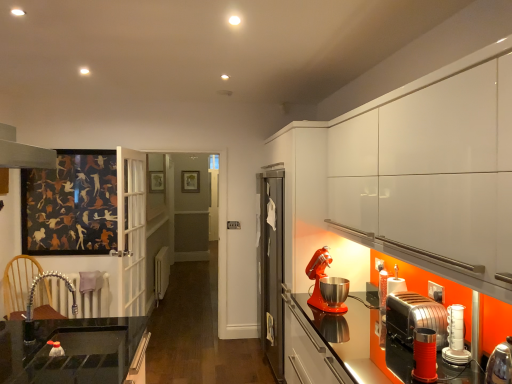
Question: Can you confirm if metallic red toaster at lower right, positioned as the 1th kitchen appliance in front-to-back order, is wider than wooden picture frame at center?

Choices:
 (A) yes
 (B) no

Answer: (A)

Question: Is metallic red toaster at lower right, which appears as the 4th kitchen appliance when viewed from the back, taller than wooden picture frame at center?

Choices:
 (A) yes
 (B) no

Answer: (B)

Question: Is metallic red toaster at lower right, positioned as the 1th kitchen appliance in front-to-back order, placed right next to wooden picture frame at center?

Choices:
 (A) yes
 (B) no

Answer: (B)

Question: From the image's perspective, would you say metallic red toaster at lower right, which appears as the 4th kitchen appliance when viewed from the back, is positioned over wooden picture frame at center?

Choices:
 (A) yes
 (B) no

Answer: (B)

Question: Considering the relative positions of metallic red toaster at lower right, which appears as the 4th kitchen appliance when viewed from the back, and wooden picture frame at center in the image provided, is metallic red toaster at lower right, which appears as the 4th kitchen appliance when viewed from the back, in front of wooden picture frame at center?

Choices:
 (A) no
 (B) yes

Answer: (B)

Question: Is wooden picture frame at center inside or outside of metallic red stand mixer at right, the fourth kitchen appliance from the front?

Choices:
 (A) inside
 (B) outside

Answer: (B)

Question: In the image, is wooden picture frame at center on the left side or the right side of metallic red stand mixer at right, the fourth kitchen appliance from the front?

Choices:
 (A) right
 (B) left

Answer: (B)

Question: In terms of size, does wooden picture frame at center appear bigger or smaller than metallic red stand mixer at right, placed as the first kitchen appliance when sorted from back to front?

Choices:
 (A) small
 (B) big

Answer: (A)

Question: In terms of width, does wooden picture frame at center look wider or thinner when compared to metallic red stand mixer at right, the fourth kitchen appliance from the front?

Choices:
 (A) wide
 (B) thin

Answer: (B)

Question: Looking at their shapes, would you say metallic red toaster at lower right, positioned as the 1th kitchen appliance in front-to-back order, is wider or thinner than wooden picture frame at center?

Choices:
 (A) thin
 (B) wide

Answer: (B)

Question: From the image's perspective, relative to wooden picture frame at center, is metallic red toaster at lower right, positioned as the 1th kitchen appliance in front-to-back order, above or below?

Choices:
 (A) above
 (B) below

Answer: (B)

Question: Choose the correct answer: Is metallic red toaster at lower right, which appears as the 4th kitchen appliance when viewed from the back, inside wooden picture frame at center or outside it?

Choices:
 (A) outside
 (B) inside

Answer: (A)

Question: Is metallic red toaster at lower right, positioned as the 1th kitchen appliance in front-to-back order, bigger or smaller than wooden picture frame at center?

Choices:
 (A) big
 (B) small

Answer: (B)

Question: Considering the positions of wooden picture frame at center and white glossy toaster at lower right, the 3th kitchen appliance when ordered from back to front, in the image, is wooden picture frame at center taller or shorter than white glossy toaster at lower right, the 3th kitchen appliance when ordered from back to front,?

Choices:
 (A) tall
 (B) short

Answer: (A)

Question: Is wooden picture frame at center to the left or to the right of white glossy toaster at lower right, the 3th kitchen appliance when ordered from back to front, in the image?

Choices:
 (A) right
 (B) left

Answer: (B)